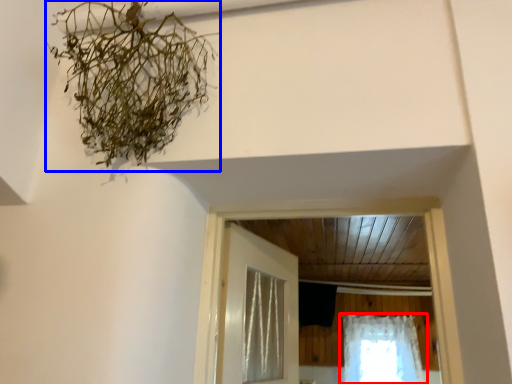
Question: Which of the following is the closest to the observer, curtain (highlighted by a red box) or plant (highlighted by a blue box)?

Choices:
 (A) curtain
 (B) plant

Answer: (B)